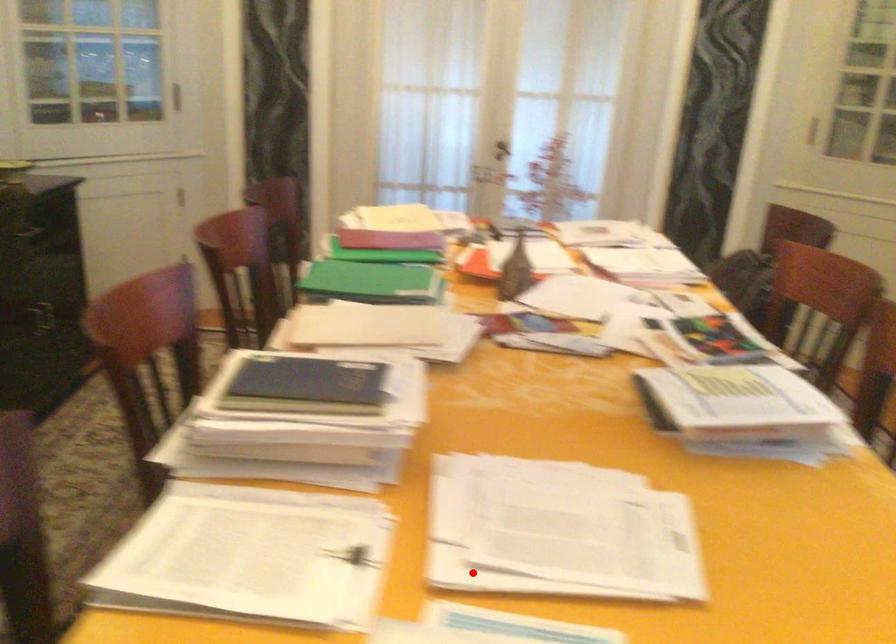
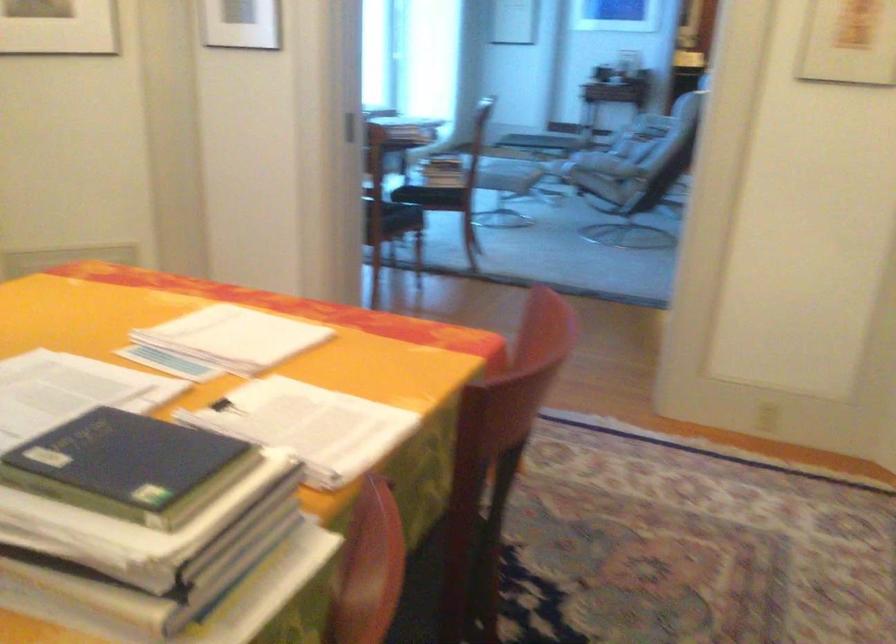
Question: I am providing you with two images of the same scene from different viewpoints. In image1, a red point is highlighted. Considering the same 3D point in image2, which of the following is correct?

Choices:
 (A) It is closer
 (B) It is farther

Answer: (B)